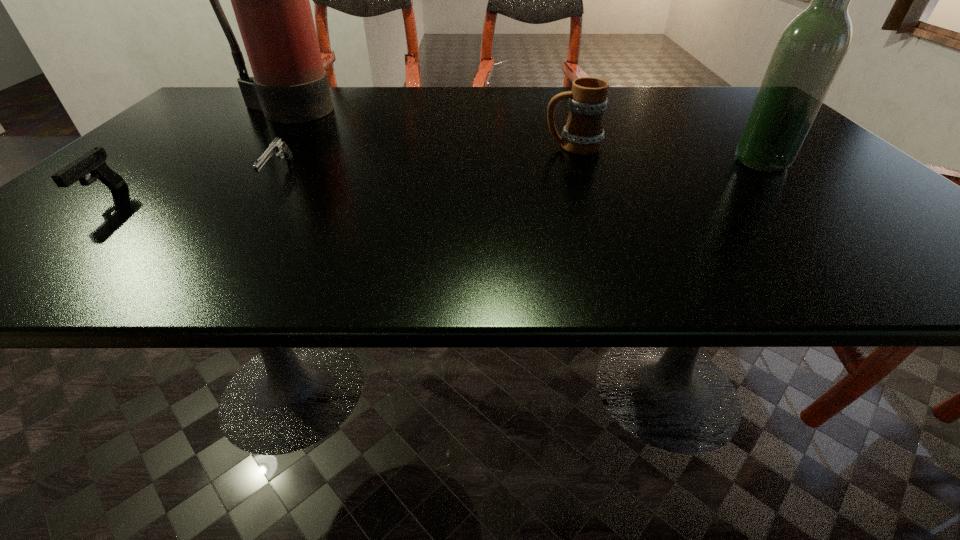
At what (x,y) coordinates should I click in order to perform the action: click on unoccupied area between the farthest object and the leftmost object. Please return your answer as a coordinate pair (x, y). This screenshot has height=540, width=960. Looking at the image, I should click on (194, 154).

Identify the location of free space between the leftmost object and the farthest object. The image size is (960, 540). (194, 154).

I want to click on free spot between the fire extinguisher and the liquor, so [x=523, y=137].

The height and width of the screenshot is (540, 960). Find the location of `free space between the rightmost object and the taller pistol`. free space between the rightmost object and the taller pistol is located at coordinates (432, 180).

Identify the location of object that is the third closest one to the third tallest object. (277, 147).

I want to click on object that can be found as the third closest to the mug, so click(x=277, y=147).

Locate an element on the screen. vacant space that satisfies the following two spatial constraints: 1. at the nozzle of the rightmost object; 2. on the left side of the farthest object is located at coordinates (240, 162).

Where is `vacant space that satisfies the following two spatial constraints: 1. on the side of the mug with the handle; 2. on the front-facing side of the shortest object`? vacant space that satisfies the following two spatial constraints: 1. on the side of the mug with the handle; 2. on the front-facing side of the shortest object is located at coordinates (583, 175).

Locate an element on the screen. This screenshot has height=540, width=960. vacant region that satisfies the following two spatial constraints: 1. on the side of the third shortest object with the handle; 2. on the front-facing side of the leftmost object is located at coordinates (591, 198).

Where is `vacant space that satisfies the following two spatial constraints: 1. on the side of the third shortest object with the handle; 2. on the back side of the rightmost object`? The height and width of the screenshot is (540, 960). vacant space that satisfies the following two spatial constraints: 1. on the side of the third shortest object with the handle; 2. on the back side of the rightmost object is located at coordinates (578, 162).